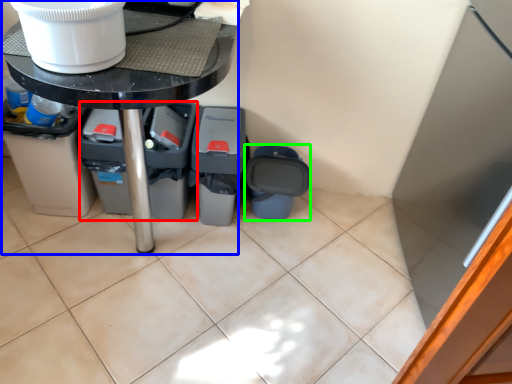
Question: Considering the real-world distances, which object is farthest from bin (highlighted by a red box)? table (highlighted by a blue box) or recycling bin (highlighted by a green box)?

Choices:
 (A) table
 (B) recycling bin

Answer: (A)